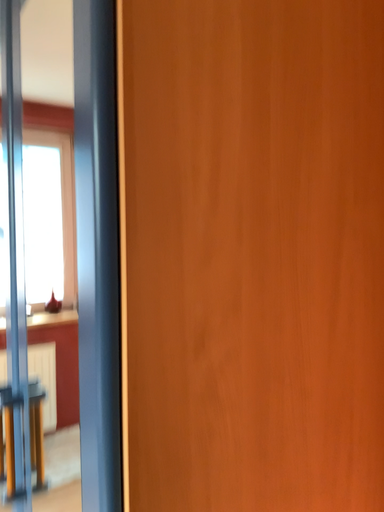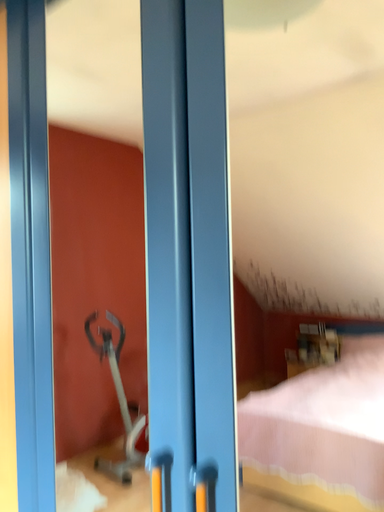
Question: Which way did the camera rotate in the video?

Choices:
 (A) rotated left
 (B) rotated right

Answer: (B)